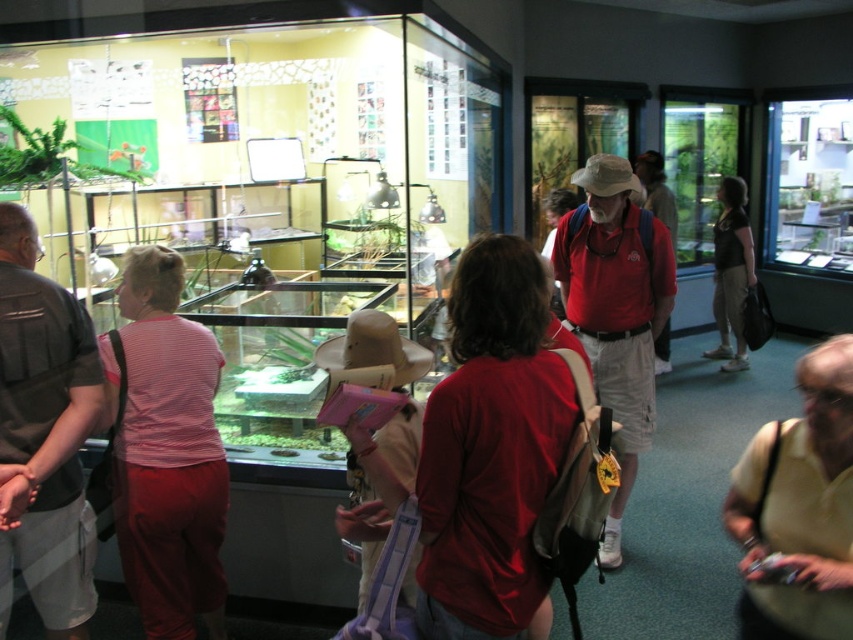
Question: Can you confirm if pink fabric hat at center is positioned below black cotton shirt at center?

Choices:
 (A) yes
 (B) no

Answer: (A)

Question: Which object is farther from the camera taking this photo?

Choices:
 (A) transparent glass tank at center
 (B) matte red shirt at center
 (C) black cotton shirt at center
 (D) yellow smooth shirt at lower right

Answer: (C)

Question: Which of the following is the closest to the observer?

Choices:
 (A) (142, 422)
 (B) (42, 300)

Answer: (B)

Question: Considering the relative positions of pink fabric hat at center and black cotton shirt at center in the image provided, where is pink fabric hat at center located with respect to black cotton shirt at center?

Choices:
 (A) below
 (B) above

Answer: (A)

Question: Based on their relative distances, which object is farther from the black cotton shirt at center?

Choices:
 (A) matte red shirt at center
 (B) pink striped shirt at center
 (C) pink fabric hat at center
 (D) transparent glass tank at center

Answer: (C)

Question: Can you confirm if pink striped shirt at center is positioned above pink fabric hat at center?

Choices:
 (A) yes
 (B) no

Answer: (B)